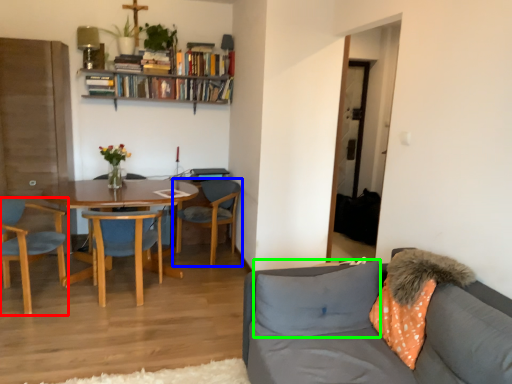
Question: Which object is the farthest from chair (highlighted by a red box)? Choose among these: chair (highlighted by a blue box) or pillow (highlighted by a green box).

Choices:
 (A) chair
 (B) pillow

Answer: (B)